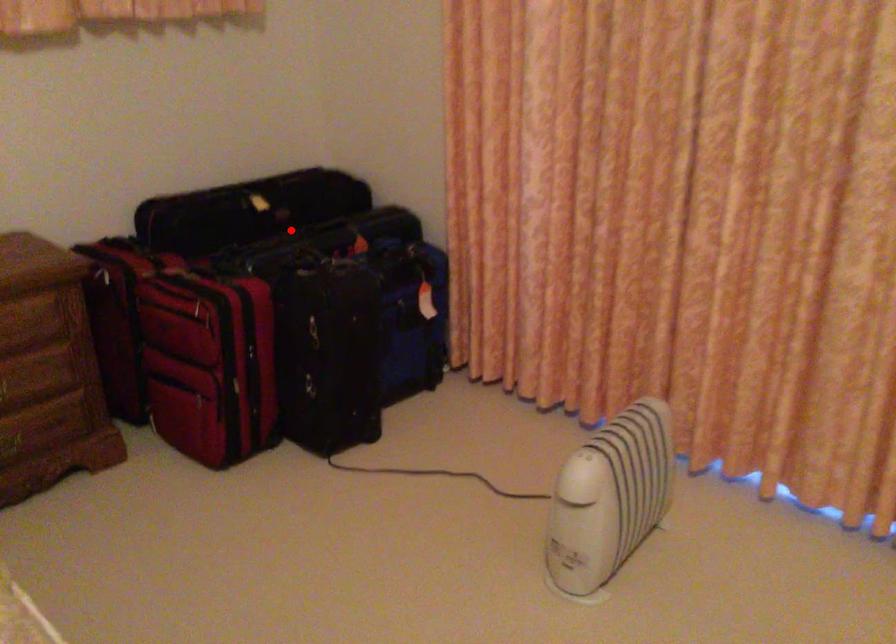
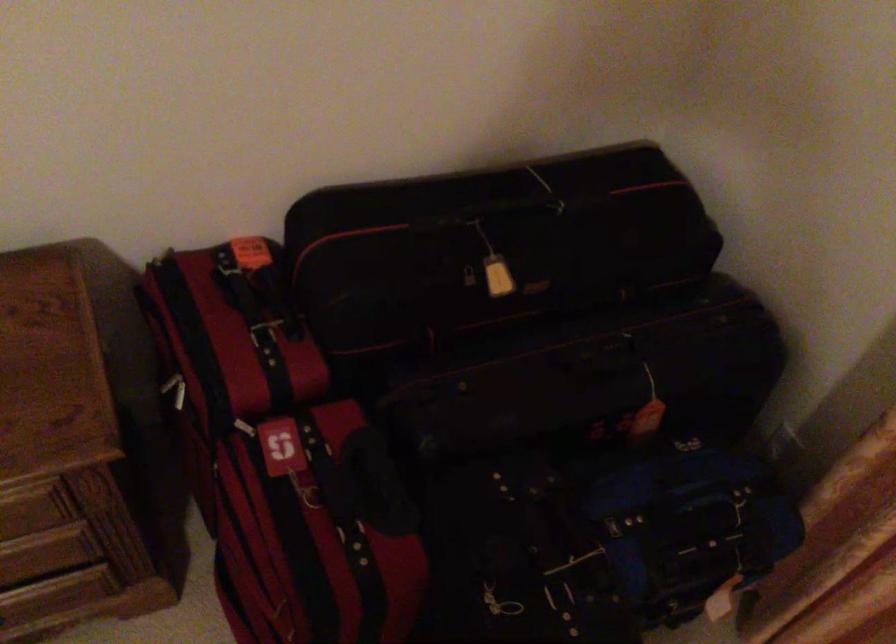
Where in the second image is the point corresponding to the highlighted location from the first image?

(527, 357)